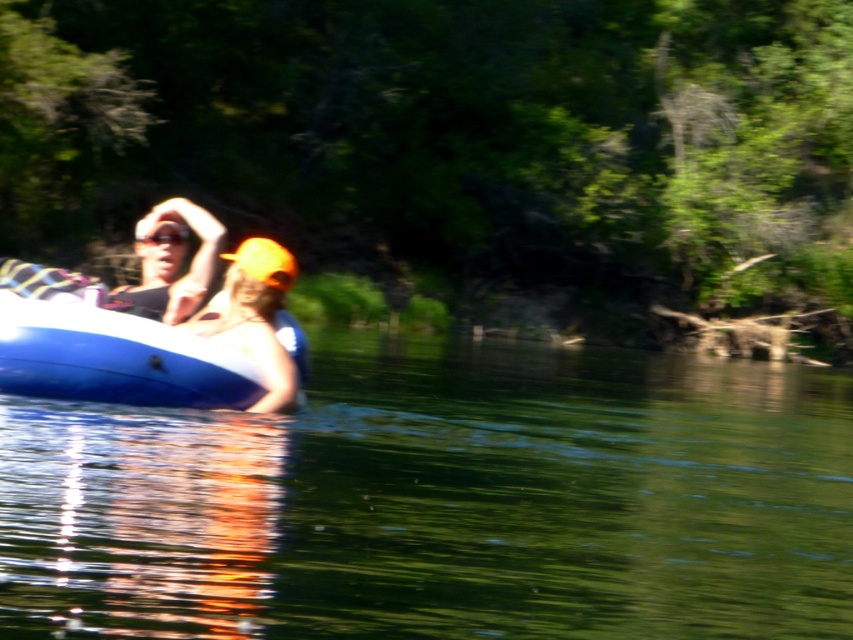
You are standing on the bank of the river and want to throw a stone to the point marked at coordinates point (22, 387). If your maximum throwing distance is 12 meters, will you be able to reach that point?

The point (22, 387) is 13.23 meters away from the viewer, which exceeds your maximum throwing distance of 12 meters. Therefore, you will not be able to reach that point.

You are a photographer trying to capture a clear shot of both the blue rubber boat at left and the orange fabric cap at center. Since you want both subjects in focus, which object should you position your camera closer to?

You should position your camera closer to the blue rubber boat at left because it is in front of the orange fabric cap at center, allowing both to be in focus when focusing on the closer object.